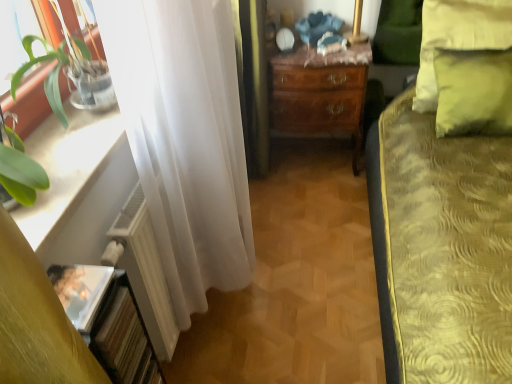
Image resolution: width=512 pixels, height=384 pixels. What are the coordinates of `vacant space underneath mahogany wooden desk at center (from a real-world perspective)` in the screenshot? It's located at (316, 165).